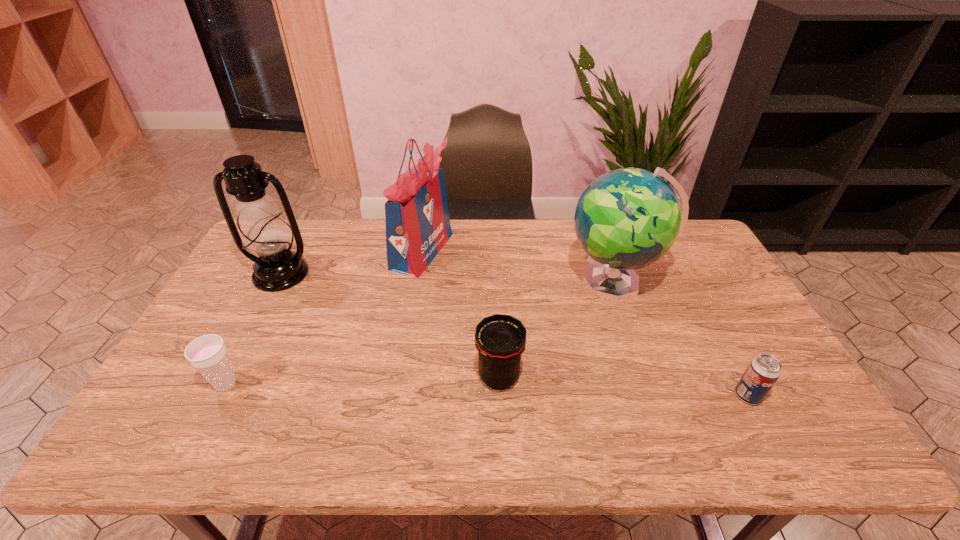
In order to click on vacant space located on the right of the oil lamp in this screenshot , I will do `click(374, 274)`.

I want to click on vacant space located 0.050m on the front of the telephoto lens, so click(x=500, y=415).

Where is `free space located on the left of the cup`? free space located on the left of the cup is located at coordinates (179, 384).

The image size is (960, 540). I want to click on free region located 0.360m on the left of the beer can, so click(588, 395).

The width and height of the screenshot is (960, 540). Find the location of `grocery bag at the far edge`. grocery bag at the far edge is located at coordinates (417, 220).

Where is `globe that is at the far edge`? globe that is at the far edge is located at coordinates (628, 218).

This screenshot has height=540, width=960. In order to click on oil lamp present at the far edge in this screenshot , I will do `click(264, 232)`.

In order to click on oil lamp at the left edge in this screenshot , I will do `click(264, 232)`.

Locate an element on the screen. cup that is at the left edge is located at coordinates (207, 353).

Locate an element on the screen. The width and height of the screenshot is (960, 540). object present at the right edge is located at coordinates (764, 370).